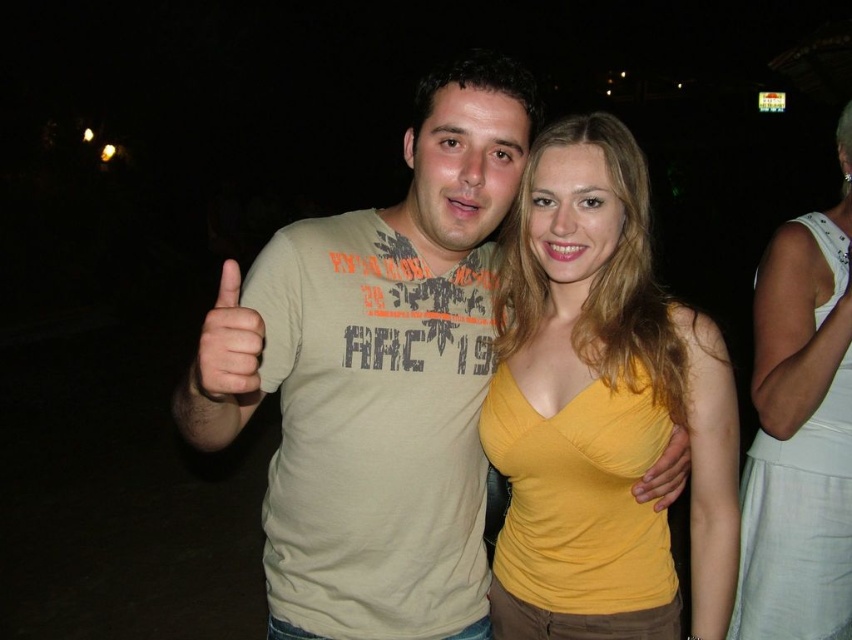
Between yellow matte tank top at center and yellow matte hand at center, which one appears on the left side from the viewer's perspective?

yellow matte tank top at center

Between yellow matte tank top at center and yellow matte hand at center, which one has more height?

With more height is yellow matte tank top at center.

Locate an element on the screen. The image size is (852, 640). yellow matte tank top at center is located at coordinates (600, 406).

This screenshot has height=640, width=852. I want to click on yellow matte tank top at center, so click(600, 406).

Which is in front, point (717, 484) or point (843, 272)?

Positioned in front is point (717, 484).

Is yellow matte tank top at center positioned before white satin dress at right?

That is True.

Is point (675, 372) farther from camera compared to point (790, 461)?

That is False.

The height and width of the screenshot is (640, 852). Find the location of `yellow matte tank top at center`. yellow matte tank top at center is located at coordinates (600, 406).

Describe the element at coordinates (799, 432) in the screenshot. I see `white satin dress at right` at that location.

From the picture: Does white satin dress at right appear on the right side of matte beige t-shirt at center?

Yes, white satin dress at right is to the right of matte beige t-shirt at center.

What do you see at coordinates (799, 432) in the screenshot? The image size is (852, 640). I see `white satin dress at right` at bounding box center [799, 432].

This screenshot has width=852, height=640. What are the coordinates of `white satin dress at right` in the screenshot? It's located at point(799,432).